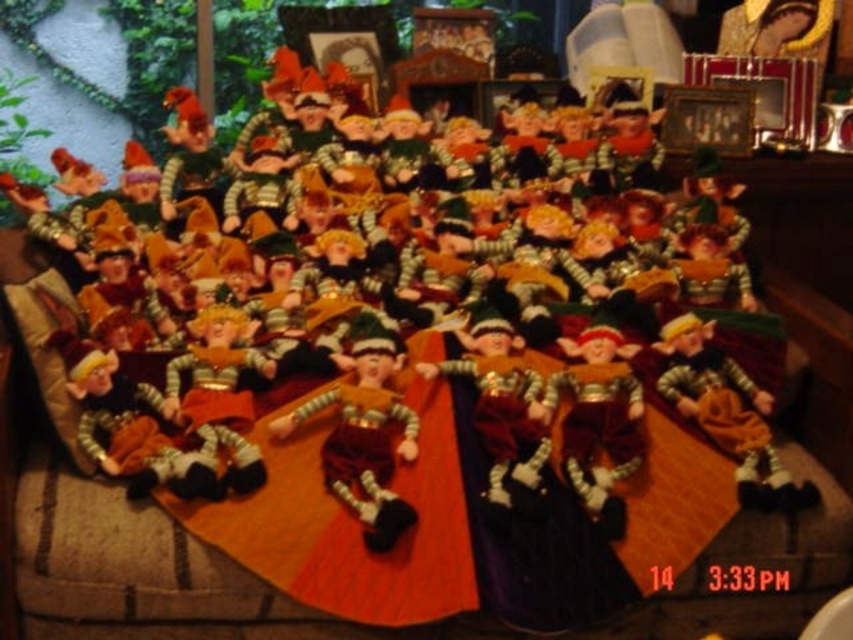
You are taking a photo of the Christmas elf display and want to focus on the point at coordinates point (183, 460) and point (479, 404). Which point is closer to your camera?

Point (183, 460) is closer to the camera than point (479, 404).